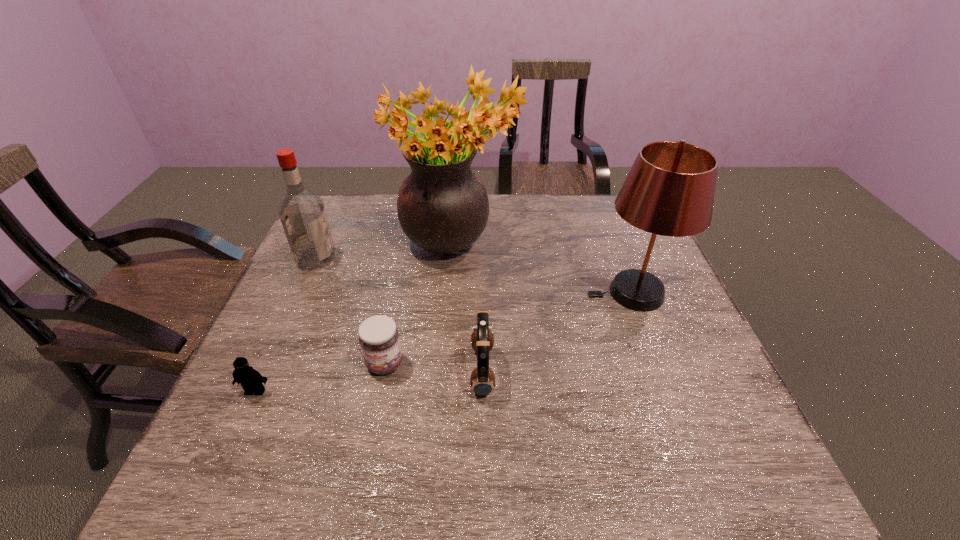
At what (x,y) coordinates should I click in order to perform the action: click on vacant region that satisfies the following two spatial constraints: 1. on the ear cup of the headset; 2. on the face of the Lego. Please return your answer as a coordinate pair (x, y). Image resolution: width=960 pixels, height=540 pixels. Looking at the image, I should click on (483, 391).